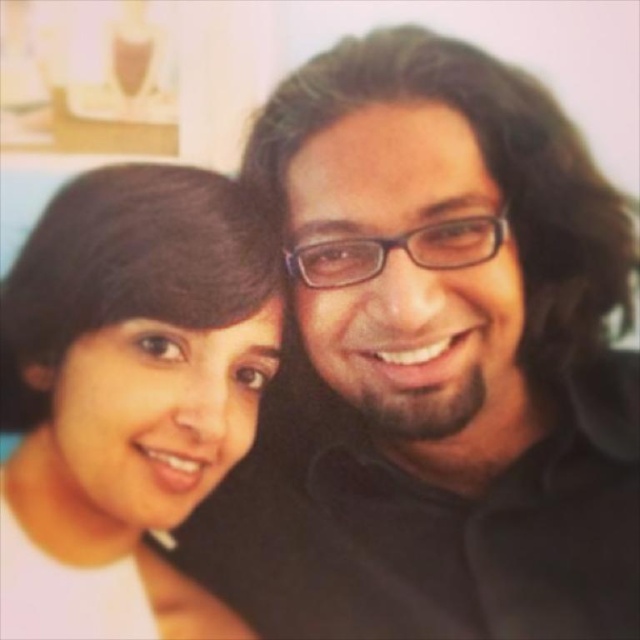
You are a photographer standing 24 inches away from the black matte shirt at center. Can you adjust your position so that you are exactly 24 inches away from it without moving the shirt?

The black matte shirt at center is currently 23.04 inches from the viewer. To be exactly 24 inches away, you would need to move back by approximately 0.96 inches.